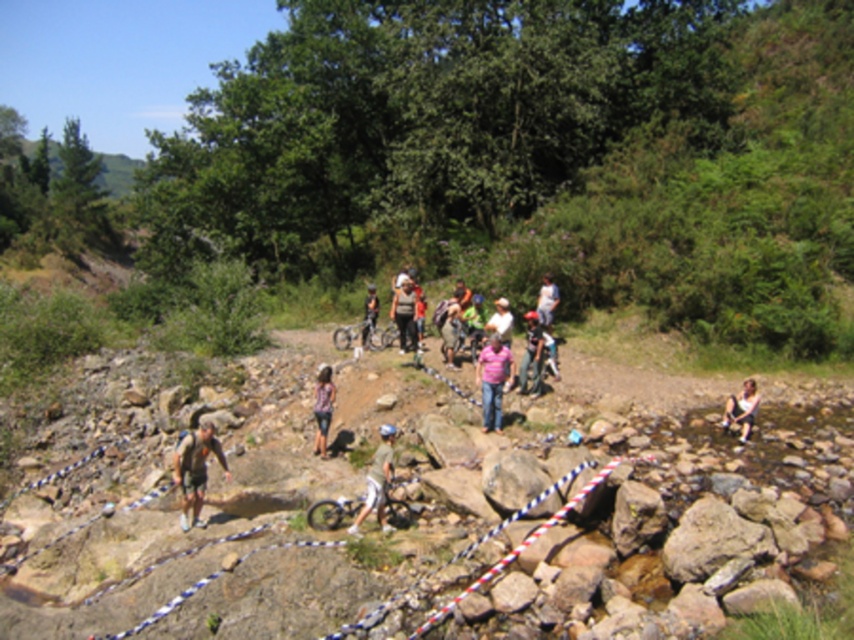
You are planning to take a photo of the matte black mountain bike at center in the park. The park has a rule that you must stay within the red and white striped rope barrier. Based on the coordinates provided, is the bike inside the barrier area?

The matte black mountain bike at center is located at point [360,333]. Since the red and white striped rope barrier runs diagonally across the scene, but the exact coordinates of the barrier are not provided, it is impossible to determine if the bike is inside the barrier area without additional information.

You are a photographer setting up equipment in the park. You need to position your tripod between the matte black mountain bike at center and the light blue denim jeans at center. Since the bike is shorter than the jeans, where should you place the tripod to ensure it doesn

The matte black mountain bike at center is shorter than the light blue denim jeans at center. To position the tripod between them, place it closer to the bike so that it can accommodate the height difference and maintain stability.

You are standing at the point marked by the coordinates point (x=360, y=333) in the image. What object is located exactly at that point?

The point (x=360, y=333) indicates the location of the matte black mountain bike at center.